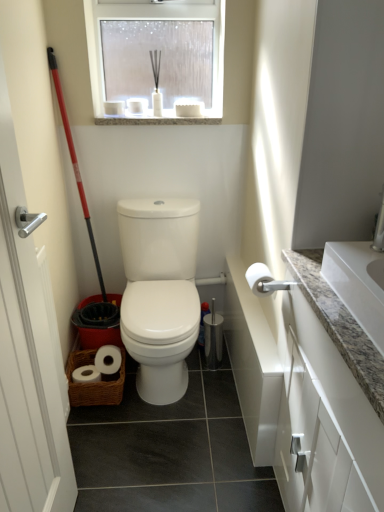
Locate an element on the screen. free space in front of white glossy toilet at center is located at coordinates (173, 413).